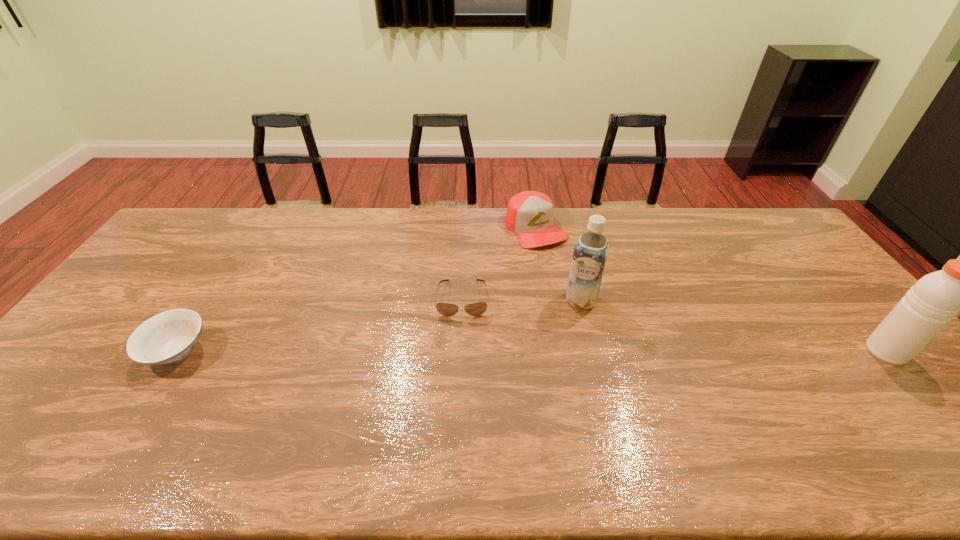
What are the coordinates of `object that is positioned at the right edge` in the screenshot? It's located at (929, 305).

Locate an element on the screen. This screenshot has width=960, height=540. vacant region at the far edge is located at coordinates (684, 244).

Locate an element on the screen. The height and width of the screenshot is (540, 960). free spot at the near edge of the desktop is located at coordinates (795, 399).

You are a GUI agent. You are given a task and a screenshot of the screen. Output one action in this format:
    pyautogui.click(x=<x>, y=<y>)
    Task: Click on the vacant space at the left edge of the desktop
    The height and width of the screenshot is (540, 960).
    Given the screenshot: What is the action you would take?
    pyautogui.click(x=70, y=349)

Identify the location of free space at the right edge of the desktop. The image size is (960, 540). (864, 390).

The height and width of the screenshot is (540, 960). I want to click on vacant space at the far right corner of the desktop, so click(x=776, y=242).

Find the location of a particular element. This screenshot has height=540, width=960. vacant space at the near right corner is located at coordinates (897, 427).

I want to click on vacant space that's between the second shortest object and the sunglasses, so click(320, 325).

This screenshot has width=960, height=540. Identify the location of free area in between the sunglasses and the rightmost object. (675, 325).

The width and height of the screenshot is (960, 540). I want to click on vacant point located between the second object from left to right and the leftmost object, so click(320, 325).